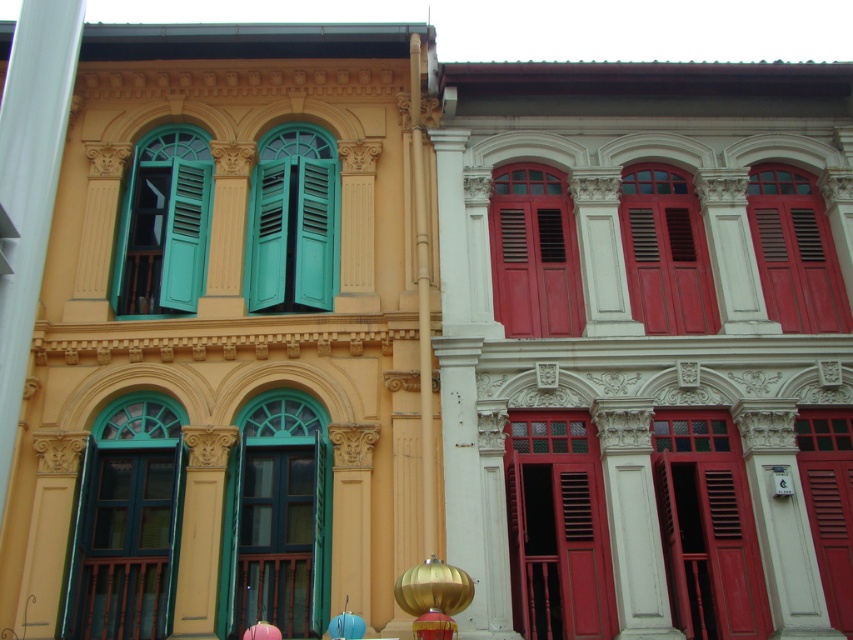
Can you confirm if matte red window at center is shorter than matte wood window at center?

Yes, matte red window at center is shorter than matte wood window at center.

This screenshot has width=853, height=640. I want to click on matte red window at center, so click(706, 528).

Does matte red wooden window at center appear on the right side of teal wooden shutters at left?

Indeed, matte red wooden window at center is positioned on the right side of teal wooden shutters at left.

Can you confirm if matte red wooden window at center is positioned above teal wooden shutters at left?

Incorrect, matte red wooden window at center is not positioned above teal wooden shutters at left.

Who is more forward, (527,588) or (186,262)?

Point (527,588) is in front.

The width and height of the screenshot is (853, 640). Find the location of `matte red wooden window at center`. matte red wooden window at center is located at coordinates (556, 529).

Between green matte window at left and matte red wooden window at center, which one has less height?

With less height is matte red wooden window at center.

Describe the element at coordinates (126, 522) in the screenshot. I see `green matte window at left` at that location.

Locate an element on the screen. green matte window at left is located at coordinates (126, 522).